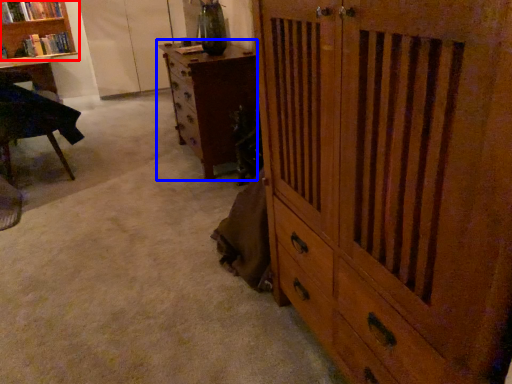
Question: Which of the following is the closest to the observer, bookcase (highlighted by a red box) or chest of drawers (highlighted by a blue box)?

Choices:
 (A) bookcase
 (B) chest of drawers

Answer: (B)